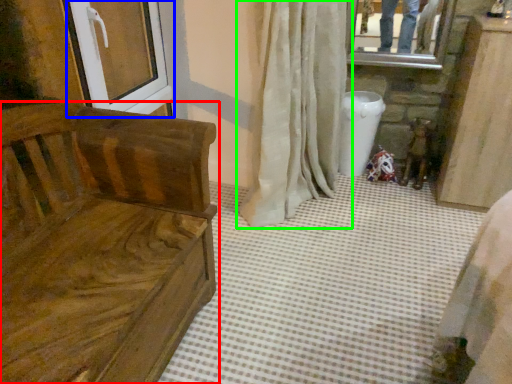
Question: Estimate the real-world distances between objects in this image. Which object is farther from furniture (highlighted by a red box), screen door (highlighted by a blue box) or curtain (highlighted by a green box)?

Choices:
 (A) screen door
 (B) curtain

Answer: (B)